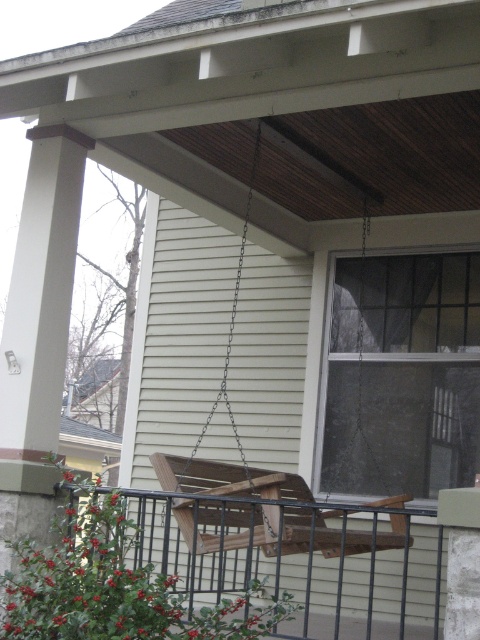
Is wooden swing at center positioned before brown wooden swing at center?

Yes, wooden swing at center is in front of brown wooden swing at center.

Does wooden swing at center have a lesser height compared to brown wooden swing at center?

In fact, wooden swing at center may be taller than brown wooden swing at center.

Which is behind, point (345, 604) or point (275, 534)?

The point (345, 604) is behind.

Find the location of `wooden swing at center`. wooden swing at center is located at coordinates (302, 563).